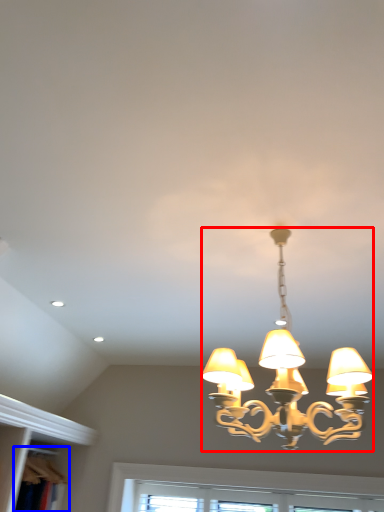
Question: Which of the following is the farthest to the observer, lamp (highlighted by a red box) or bookshelf (highlighted by a blue box)?

Choices:
 (A) lamp
 (B) bookshelf

Answer: (B)